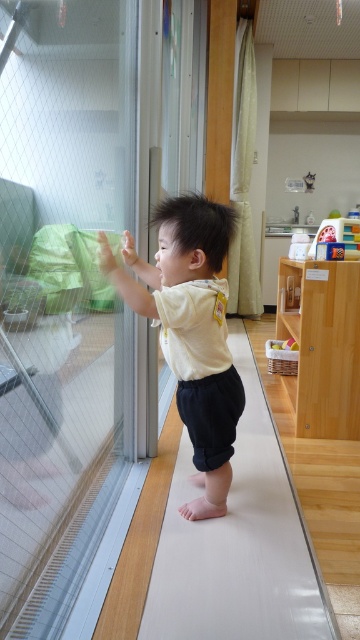
Question: Can you confirm if transparent glass door at left is smaller than plastic colorful blocks at upper right?

Choices:
 (A) no
 (B) yes

Answer: (A)

Question: Which is farther from the transparent glass door at left?

Choices:
 (A) white smooth ramp at center
 (B) white cotton shirt at center

Answer: (A)

Question: Which point appears closest to the camera in this image?

Choices:
 (A) (320, 236)
 (B) (258, 554)

Answer: (B)

Question: Is transparent glass door at left further to the viewer compared to plastic colorful blocks at upper right?

Choices:
 (A) yes
 (B) no

Answer: (B)

Question: Can you confirm if white smooth ramp at center is bigger than white cotton shirt at center?

Choices:
 (A) yes
 (B) no

Answer: (A)

Question: Which point is farther from the camera taking this photo?

Choices:
 (A) (237, 406)
 (B) (212, 634)

Answer: (A)